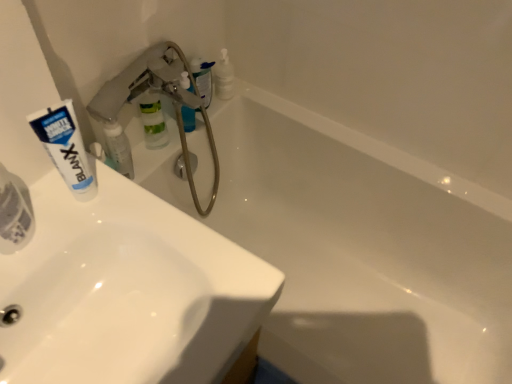
Identify the location of vacant space to the right of translucent plastic toothpaste tube at left, placed as the fourth toiletry when sorted from back to front. (138, 247).